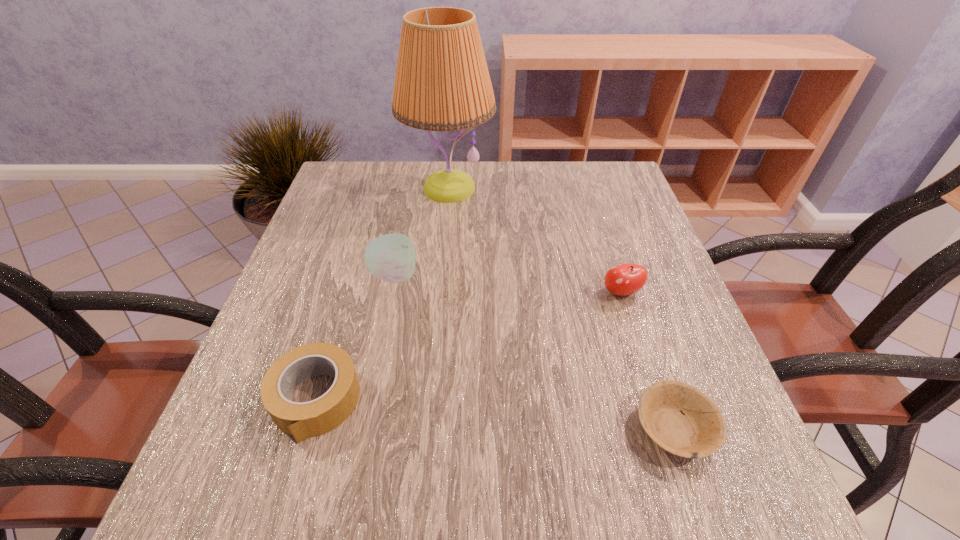
In the image, there is a desktop. Where is `free space at the left edge`? This screenshot has width=960, height=540. free space at the left edge is located at coordinates (282, 317).

Image resolution: width=960 pixels, height=540 pixels. I want to click on vacant space at the right edge of the desktop, so click(713, 369).

In the image, there is a desktop. Where is `vacant space at the far left corner`? vacant space at the far left corner is located at coordinates (348, 170).

Locate an element on the screen. Image resolution: width=960 pixels, height=540 pixels. free spot at the near right corner of the desktop is located at coordinates (704, 476).

This screenshot has height=540, width=960. In order to click on free area in between the farthest object and the duct tape in this screenshot , I will do (382, 294).

You are a GUI agent. You are given a task and a screenshot of the screen. Output one action in this format:
    pyautogui.click(x=<x>, y=<y>)
    Task: Click on the free spot between the left apple and the right apple
    Image resolution: width=960 pixels, height=540 pixels.
    Given the screenshot: What is the action you would take?
    pyautogui.click(x=508, y=284)

Locate an element on the screen. This screenshot has width=960, height=540. vacant space that is in between the lamp and the shorter apple is located at coordinates (535, 240).

Identify the location of empty space that is in between the tallest object and the right apple. The height and width of the screenshot is (540, 960). tap(535, 240).

Image resolution: width=960 pixels, height=540 pixels. Identify the location of free space between the taller apple and the fourth tallest object. (355, 338).

Identify the location of vacant area that lies between the lamp and the third shortest object. Image resolution: width=960 pixels, height=540 pixels. (535, 240).